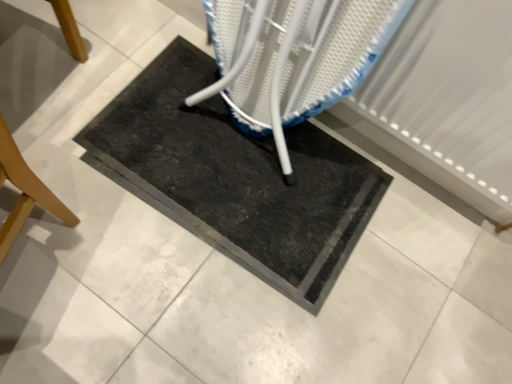
In order to click on vacant point above black rubber mat at center (from a real-world perspective) in this screenshot , I will do `click(229, 163)`.